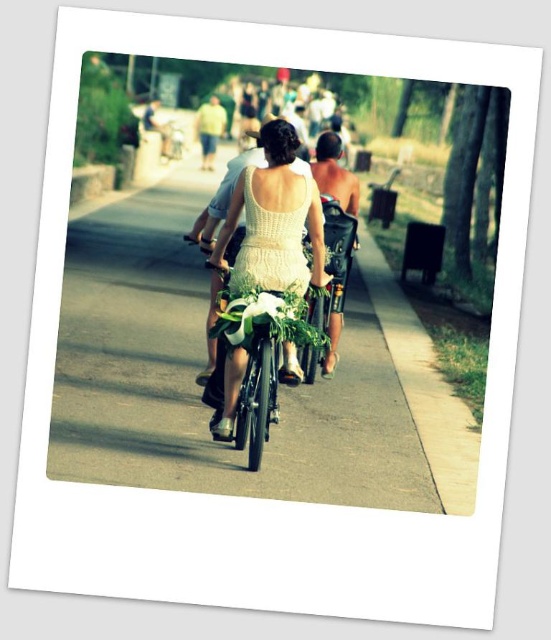
Is white lace dress at center wider than smooth tan shirt at upper center?

Incorrect, white lace dress at center's width does not surpass smooth tan shirt at upper center's.

Who is lower down, white lace dress at center or smooth tan shirt at upper center?

white lace dress at center is below.

Is point (289, 218) positioned before point (164, 145)?

Yes, it is in front of point (164, 145).

Where is `white lace dress at center`? The height and width of the screenshot is (640, 551). white lace dress at center is located at coordinates (274, 220).

Between white lace dress at center and light green fabric shirt at center, which one is positioned higher?

Positioned higher is light green fabric shirt at center.

Is point (214, 248) positioned after point (209, 138)?

No, (214, 248) is in front of (209, 138).

The width and height of the screenshot is (551, 640). I want to click on white lace dress at center, so click(x=274, y=220).

Where is `white lace dress at center`? This screenshot has height=640, width=551. white lace dress at center is located at coordinates (274, 220).

Is shiny metallic helmet at center above light green fabric shirt at center?

Actually, shiny metallic helmet at center is below light green fabric shirt at center.

Who is shorter, shiny metallic helmet at center or light green fabric shirt at center?

shiny metallic helmet at center is shorter.

Describe the element at coordinates (334, 173) in the screenshot. This screenshot has width=551, height=640. I see `shiny metallic helmet at center` at that location.

In order to click on shiny metallic helmet at center in this screenshot , I will do `click(334, 173)`.